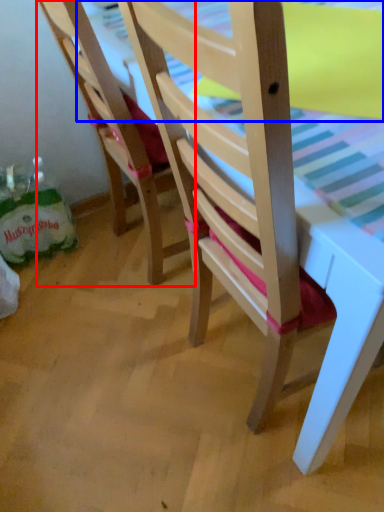
Question: Which of the following is the closest to the observer, chair (highlighted by a red box) or table top (highlighted by a blue box)?

Choices:
 (A) chair
 (B) table top

Answer: (B)